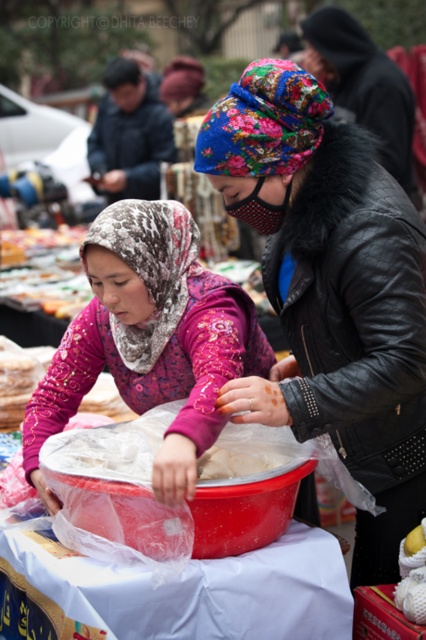
Is the position of pink floral fabric at center less distant than that of white matte apple at center?

Yes, it is.

Image resolution: width=426 pixels, height=640 pixels. Describe the element at coordinates (149, 337) in the screenshot. I see `pink floral fabric at center` at that location.

Where is `pink floral fabric at center`? This screenshot has width=426, height=640. pink floral fabric at center is located at coordinates (149, 337).

Is point (141, 262) closer to camera compared to point (109, 132)?

Yes, point (141, 262) is in front of point (109, 132).

The height and width of the screenshot is (640, 426). I want to click on pink floral fabric at center, so click(149, 337).

Consider the image. Is white matte apple at center wider than white fluffy dough at center?

No, white matte apple at center is not wider than white fluffy dough at center.

Who is shorter, white matte apple at center or white fluffy dough at center?

white fluffy dough at center

What do you see at coordinates (412, 573) in the screenshot? I see `white matte apple at center` at bounding box center [412, 573].

I want to click on white matte apple at center, so click(412, 573).